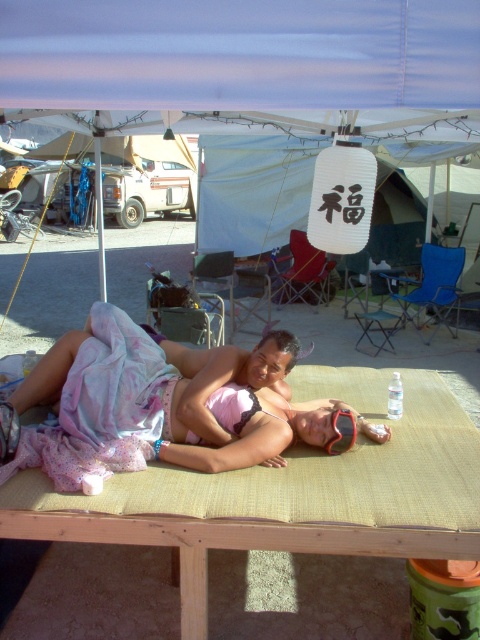
Which is behind, point (339, 422) or point (26, 349)?

Positioned behind is point (26, 349).

Where is `black rubber goggles at center`? black rubber goggles at center is located at coordinates (342, 432).

Is transparent plastic bottle at center behind clear plastic bottle at center?

No, transparent plastic bottle at center is in front of clear plastic bottle at center.

The width and height of the screenshot is (480, 640). Identify the location of transparent plastic bottle at center. (395, 396).

Describe the element at coordinates (395, 396) in the screenshot. The height and width of the screenshot is (640, 480). I see `transparent plastic bottle at center` at that location.

In order to click on transparent plastic bottle at center in this screenshot , I will do `click(395, 396)`.

Measure the distance between point [400,83] and camera.

The distance of point [400,83] from camera is 6.52 feet.

Is point (12, 54) in front of point (280, 481)?

Yes, it is in front of point (280, 481).

The width and height of the screenshot is (480, 640). What do you see at coordinates (239, 52) in the screenshot?
I see `white fabric canopy at upper center` at bounding box center [239, 52].

At what (x,y) coordinates should I click in order to perform the action: click on white fabric canopy at upper center. Please return your answer as a coordinate pair (x, y). The width and height of the screenshot is (480, 640). Looking at the image, I should click on (239, 52).